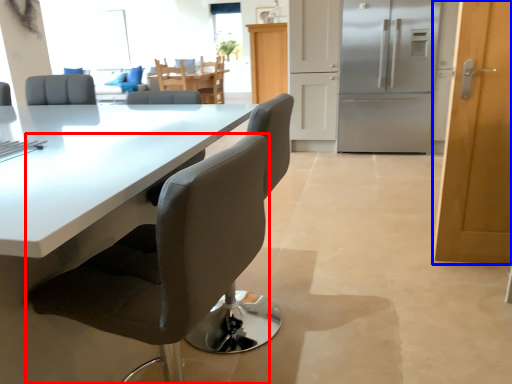
Question: Which object appears farthest to the camera in this image, chair (highlighted by a red box) or door (highlighted by a blue box)?

Choices:
 (A) chair
 (B) door

Answer: (B)